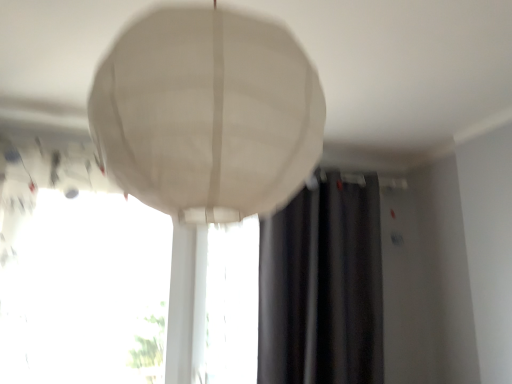
This screenshot has width=512, height=384. Describe the element at coordinates (87, 294) in the screenshot. I see `transparent glass window at center, which ranks as the second window in right-to-left order` at that location.

The height and width of the screenshot is (384, 512). What do you see at coordinates (322, 285) in the screenshot? I see `dark gray fabric curtain at center` at bounding box center [322, 285].

Find the location of a particular element. The height and width of the screenshot is (384, 512). transparent glass window at center, which ranks as the second window in right-to-left order is located at coordinates (87, 294).

Find the location of a particular element. The image size is (512, 384). window that is the 1st object to the left of the dark gray fabric curtain at center, starting at the anchor is located at coordinates (231, 304).

From a real-world perspective, is transparent glass window at center, the first window from the right, physically located above or below dark gray fabric curtain at center?

In terms of real-world spatial position, transparent glass window at center, the first window from the right, is below dark gray fabric curtain at center.

From the picture: Can you confirm if transparent glass window at center, the second window when ordered from left to right, is bigger than dark gray fabric curtain at center?

No, transparent glass window at center, the second window when ordered from left to right, is not bigger than dark gray fabric curtain at center.

In terms of height, does transparent glass window at center, the second window when ordered from left to right, look taller or shorter compared to dark gray fabric curtain at center?

transparent glass window at center, the second window when ordered from left to right, is shorter than dark gray fabric curtain at center.

From the image's perspective, which is above, white fabric lampshade at center or dark gray fabric curtain at center?

white fabric lampshade at center is shown above in the image.

Can you confirm if white fabric lampshade at center is thinner than dark gray fabric curtain at center?

No, white fabric lampshade at center is not thinner than dark gray fabric curtain at center.

Does white fabric lampshade at center turn towards dark gray fabric curtain at center?

No, white fabric lampshade at center is not aimed at dark gray fabric curtain at center.

Which object is closer to the camera, white fabric lampshade at center or dark gray fabric curtain at center?

white fabric lampshade at center is more forward.

Find the location of a particular element. window that is the 2nd one when counting backward from the white fabric lampshade at center is located at coordinates (231, 304).

Which of these two, white fabric lampshade at center or transparent glass window at center, the second window when ordered from left to right, is thinner?

transparent glass window at center, the second window when ordered from left to right.

Would you say transparent glass window at center, the second window when ordered from left to right, is part of white fabric lampshade at center's contents?

No, transparent glass window at center, the second window when ordered from left to right, is located outside of white fabric lampshade at center.

Measure the distance from white fabric lampshade at center to transparent glass window at center, the second window when ordered from left to right.

The distance of white fabric lampshade at center from transparent glass window at center, the second window when ordered from left to right, is 1.69 meters.

Is transparent glass window at center, which ranks as the second window in right-to-left order, not inside white fabric lampshade at center?

That's correct, transparent glass window at center, which ranks as the second window in right-to-left order, is outside of white fabric lampshade at center.

Between transparent glass window at center, which ranks as the first window in left-to-right order, and white fabric lampshade at center, which one is positioned behind?

transparent glass window at center, which ranks as the first window in left-to-right order, is behind.

Which point is more forward, (x=96, y=280) or (x=178, y=185)?

The point (x=178, y=185) is closer to the camera.

Which object is wider, transparent glass window at center, which ranks as the first window in left-to-right order, or white fabric lampshade at center?

white fabric lampshade at center.

Which is farther, [227,364] or [141,154]?

The point [227,364] is farther from the camera.

Could you tell me if transparent glass window at center, the second window when ordered from left to right, is turned towards white fabric lampshade at center?

Yes.

Between transparent glass window at center, the first window from the right, and white fabric lampshade at center, which one has more height?

transparent glass window at center, the first window from the right, is taller.

Can you see transparent glass window at center, the second window when ordered from left to right, touching white fabric lampshade at center?

No, transparent glass window at center, the second window when ordered from left to right, is not making contact with white fabric lampshade at center.

Does transparent glass window at center, the second window when ordered from left to right, appear on the left side of transparent glass window at center, which ranks as the second window in right-to-left order?

No.

How much distance is there between transparent glass window at center, the second window when ordered from left to right, and transparent glass window at center, which ranks as the first window in left-to-right order?

transparent glass window at center, the second window when ordered from left to right, is 22.12 inches away from transparent glass window at center, which ranks as the first window in left-to-right order.

From a real-world perspective, between transparent glass window at center, the first window from the right, and transparent glass window at center, which ranks as the first window in left-to-right order, who is vertically higher?

transparent glass window at center, which ranks as the first window in left-to-right order, from a real-world perspective.

From the picture: Who is bigger, transparent glass window at center, the first window from the right, or transparent glass window at center, which ranks as the second window in right-to-left order?

Bigger between the two is transparent glass window at center, which ranks as the second window in right-to-left order.

Considering their positions, is dark gray fabric curtain at center located in front of or behind transparent glass window at center, the first window from the right?

dark gray fabric curtain at center is positioned closer to the viewer than transparent glass window at center, the first window from the right.

Based on the photo, is dark gray fabric curtain at center not within transparent glass window at center, the first window from the right?

dark gray fabric curtain at center is positioned outside transparent glass window at center, the first window from the right.

Is dark gray fabric curtain at center oriented away from transparent glass window at center, the second window when ordered from left to right?

Yes, transparent glass window at center, the second window when ordered from left to right, is at the back of dark gray fabric curtain at center.

The image size is (512, 384). In order to click on curtain positioned vertically above the transparent glass window at center, the first window from the right (from a real-world perspective) in this screenshot , I will do `click(322, 285)`.

Where is `lamp in front of the dark gray fabric curtain at center`? This screenshot has height=384, width=512. lamp in front of the dark gray fabric curtain at center is located at coordinates (207, 114).

Looking at the image, which one is located closer to transparent glass window at center, which ranks as the second window in right-to-left order, transparent glass window at center, the first window from the right, or dark gray fabric curtain at center?

Among the two, transparent glass window at center, the first window from the right, is located nearer to transparent glass window at center, which ranks as the second window in right-to-left order.

Based on their spatial positions, is white fabric lampshade at center or transparent glass window at center, the first window from the right, closer to dark gray fabric curtain at center?

transparent glass window at center, the first window from the right.

When comparing their distances from dark gray fabric curtain at center, does white fabric lampshade at center or transparent glass window at center, which ranks as the second window in right-to-left order, seem further?

white fabric lampshade at center is positioned further to the anchor dark gray fabric curtain at center.

Based on their spatial positions, is dark gray fabric curtain at center or transparent glass window at center, which ranks as the second window in right-to-left order, closer to transparent glass window at center, the second window when ordered from left to right?

Based on the image, dark gray fabric curtain at center appears to be nearer to transparent glass window at center, the second window when ordered from left to right.

Looking at the image, which one is located further to dark gray fabric curtain at center, transparent glass window at center, the second window when ordered from left to right, or transparent glass window at center, which ranks as the first window in left-to-right order?

The object further to dark gray fabric curtain at center is transparent glass window at center, which ranks as the first window in left-to-right order.

In the scene shown: Looking at the image, which one is located closer to white fabric lampshade at center, transparent glass window at center, which ranks as the first window in left-to-right order, or dark gray fabric curtain at center?

Among the two, transparent glass window at center, which ranks as the first window in left-to-right order, is located nearer to white fabric lampshade at center.

Looking at the image, which one is located closer to transparent glass window at center, which ranks as the first window in left-to-right order, dark gray fabric curtain at center or white fabric lampshade at center?

dark gray fabric curtain at center is closer to transparent glass window at center, which ranks as the first window in left-to-right order.

Looking at the image, which one is located closer to white fabric lampshade at center, dark gray fabric curtain at center or transparent glass window at center, which ranks as the first window in left-to-right order?

Based on the image, transparent glass window at center, which ranks as the first window in left-to-right order, appears to be nearer to white fabric lampshade at center.

Identify the location of window between transparent glass window at center, which ranks as the second window in right-to-left order, and dark gray fabric curtain at center, in the horizontal direction. The width and height of the screenshot is (512, 384). (231, 304).

Identify the location of window located between white fabric lampshade at center and transparent glass window at center, the second window when ordered from left to right, in the depth direction. (87, 294).

What are the coordinates of `window between white fabric lampshade at center and dark gray fabric curtain at center from front to back` in the screenshot? It's located at (87, 294).

The image size is (512, 384). Identify the location of curtain between white fabric lampshade at center and transparent glass window at center, the second window when ordered from left to right, in the front-back direction. (322, 285).